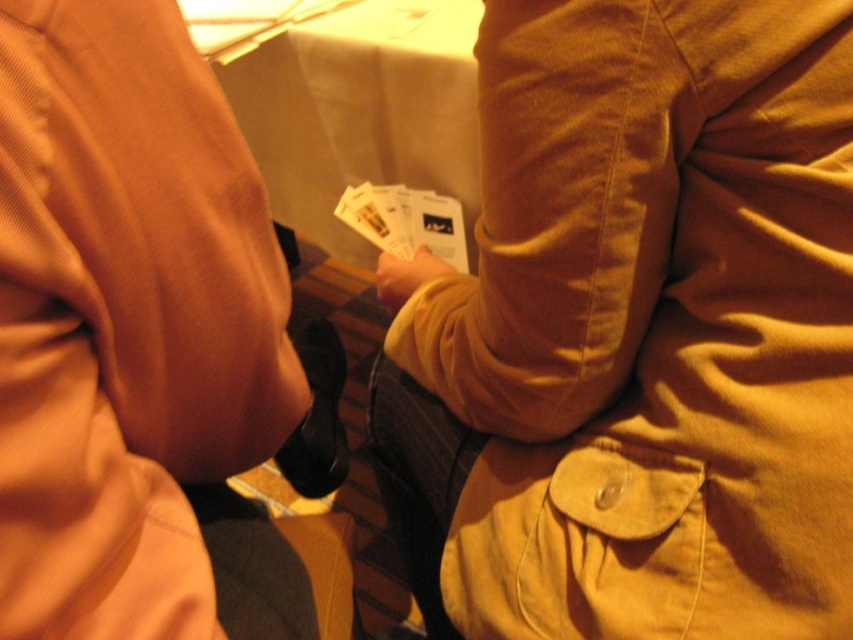
Does matte orange jacket at upper left lie in front of matte yellow hand at center?

Yes, it is.

Does point (64, 58) come in front of point (393, 289)?

Yes, it is in front of point (393, 289).

Find the location of a particular element. This screenshot has height=640, width=853. matte orange jacket at upper left is located at coordinates (148, 348).

Does matte brown jacket at center have a lesser width compared to matte yellow hand at center?

In fact, matte brown jacket at center might be wider than matte yellow hand at center.

Measure the distance between matte brown jacket at center and camera.

The distance of matte brown jacket at center from camera is 40.75 centimeters.

Locate an element on the screen. matte brown jacket at center is located at coordinates (637, 333).

Which is more to the left, matte brown jacket at center or matte orange jacket at upper left?

matte orange jacket at upper left is more to the left.

How far apart are matte brown jacket at center and matte orange jacket at upper left?

matte brown jacket at center and matte orange jacket at upper left are 21.09 centimeters apart.

Is point (451, 561) closer to viewer compared to point (195, 193)?

That is False.

The width and height of the screenshot is (853, 640). I want to click on matte brown jacket at center, so click(x=637, y=333).